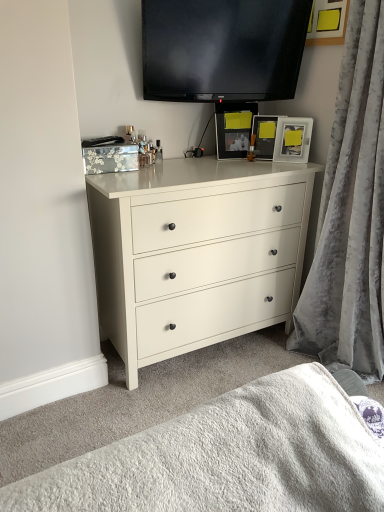
Where is `free space in front of matte silver picture frame at upper right, the first picture frame from the right`? Image resolution: width=384 pixels, height=512 pixels. free space in front of matte silver picture frame at upper right, the first picture frame from the right is located at coordinates (288, 163).